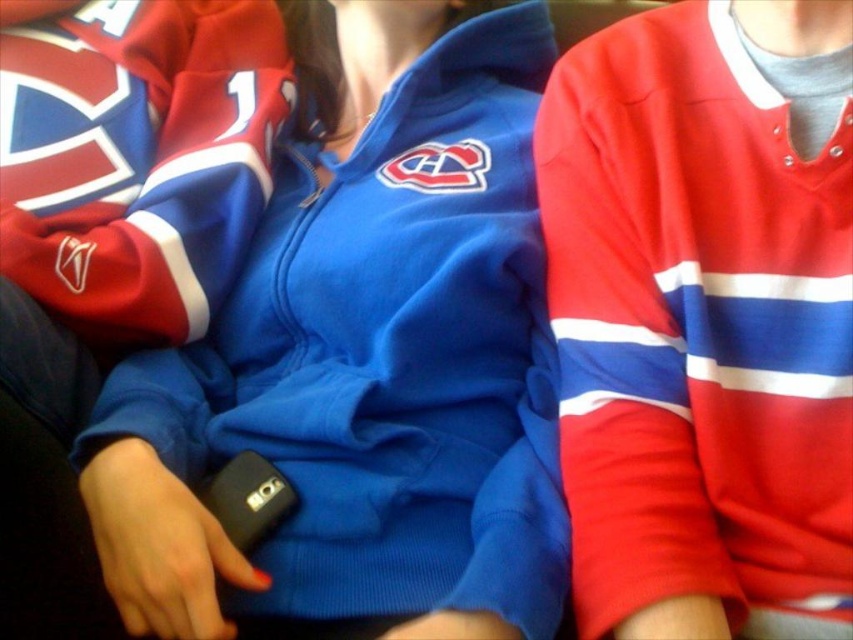
Question: Which point is closer to the camera?

Choices:
 (A) (102, 445)
 (B) (743, 96)

Answer: (B)

Question: Is matte blue hoodie at center behind matte jersey at center?

Choices:
 (A) no
 (B) yes

Answer: (B)

Question: Which of the following is the closest to the observer?

Choices:
 (A) matte blue hoodie at center
 (B) matte jersey at center

Answer: (B)

Question: Does matte blue hoodie at center have a greater width compared to matte jersey at center?

Choices:
 (A) no
 (B) yes

Answer: (B)

Question: Which object appears closest to the camera in this image?

Choices:
 (A) matte jersey at center
 (B) matte blue hoodie at center

Answer: (A)

Question: Is matte blue hoodie at center to the left of matte jersey at center from the viewer's perspective?

Choices:
 (A) no
 (B) yes

Answer: (B)